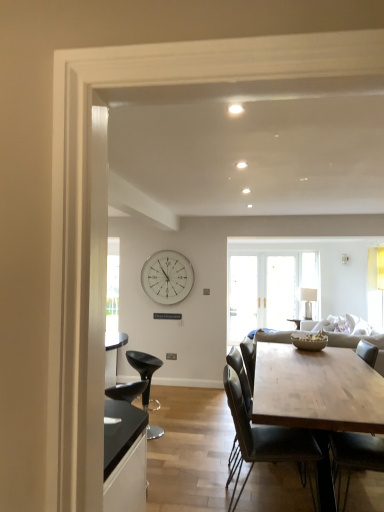
Question: Can you confirm if natural wood table at center is smaller than white glossy clock at upper center?

Choices:
 (A) yes
 (B) no

Answer: (B)

Question: Is natural wood table at center thinner than white glossy clock at upper center?

Choices:
 (A) yes
 (B) no

Answer: (B)

Question: Is natural wood table at center wider than white glossy clock at upper center?

Choices:
 (A) yes
 (B) no

Answer: (A)

Question: From a real-world perspective, is natural wood table at center under white glossy clock at upper center?

Choices:
 (A) yes
 (B) no

Answer: (A)

Question: From a real-world perspective, is natural wood table at center located higher than white glossy clock at upper center?

Choices:
 (A) yes
 (B) no

Answer: (B)

Question: Is point (339, 339) positioned closer to the camera than point (362, 455)?

Choices:
 (A) farther
 (B) closer

Answer: (A)

Question: Is light gray fabric couch at center taller or shorter than wooden chair at center, which is the 3th chair from left to right?

Choices:
 (A) tall
 (B) short

Answer: (B)

Question: From a real-world perspective, is light gray fabric couch at center positioned above or below wooden chair at center, the third chair in the back-to-front sequence?

Choices:
 (A) below
 (B) above

Answer: (B)

Question: Choose the correct answer: Is light gray fabric couch at center inside wooden chair at center, positioned as the 1th chair in right-to-left order, or outside it?

Choices:
 (A) inside
 (B) outside

Answer: (B)

Question: Which is correct: black plastic stool at lower left, the first chair in the back-to-front sequence, is inside wooden chair at center, which is the 3th chair from left to right, or outside of it?

Choices:
 (A) inside
 (B) outside

Answer: (B)

Question: From a real-world perspective, relative to wooden chair at center, which is the 3th chair from left to right, is black plastic stool at lower left, marked as the 3th chair in a right-to-left arrangement, vertically above or below?

Choices:
 (A) below
 (B) above

Answer: (A)

Question: Considering the positions of black plastic stool at lower left, marked as the 3th chair in a front-to-back arrangement, and wooden chair at center, the third chair in the back-to-front sequence, in the image, is black plastic stool at lower left, marked as the 3th chair in a front-to-back arrangement, bigger or smaller than wooden chair at center, the third chair in the back-to-front sequence,?

Choices:
 (A) small
 (B) big

Answer: (A)

Question: Considering the positions of point (147, 433) and point (372, 350), is point (147, 433) closer or farther from the camera than point (372, 350)?

Choices:
 (A) farther
 (B) closer

Answer: (B)

Question: Visually, is dark gray leather chair at center, the second chair viewed from the right, positioned to the left or to the right of white glossy clock at upper center?

Choices:
 (A) right
 (B) left

Answer: (A)

Question: From the image's perspective, relative to white glossy clock at upper center, is dark gray leather chair at center, the 2th chair from the left, above or below?

Choices:
 (A) below
 (B) above

Answer: (A)